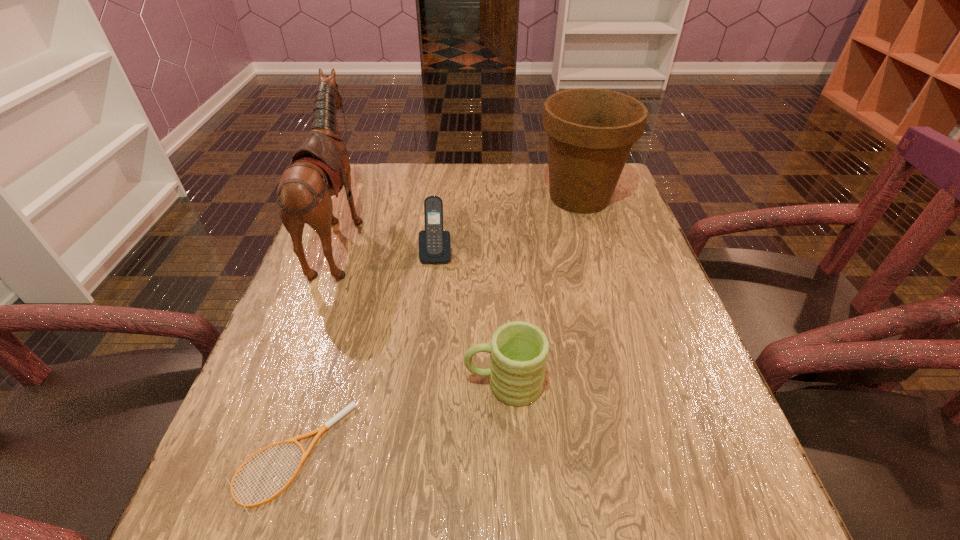
In the image, there is a desktop. Where is `vacant region at the far right corner`? vacant region at the far right corner is located at coordinates (620, 187).

Find the location of a particular element. The image size is (960, 540). vacant point located between the mug and the tallest object is located at coordinates (423, 309).

You are a GUI agent. You are given a task and a screenshot of the screen. Output one action in this format:
    pyautogui.click(x=<x>, y=<y>)
    Task: Click on the empty space that is in between the saddle and the fourth object from left to right
    Image resolution: width=960 pixels, height=540 pixels.
    Given the screenshot: What is the action you would take?
    pyautogui.click(x=423, y=309)

The image size is (960, 540). Find the location of `vacant point located between the shortest object and the tallest object`. vacant point located between the shortest object and the tallest object is located at coordinates (317, 345).

The height and width of the screenshot is (540, 960). I want to click on free space between the saddle and the shortest object, so click(x=317, y=345).

Identify the location of free space that is in between the cellular telephone and the saddle. (389, 245).

This screenshot has width=960, height=540. What are the coordinates of `unoccupied position between the third shortest object and the second tallest object` in the screenshot? It's located at [508, 226].

At what (x,y) coordinates should I click in order to perform the action: click on free space between the saddle and the rightmost object. Please return your answer as a coordinate pair (x, y). The width and height of the screenshot is (960, 540). Looking at the image, I should click on (461, 216).

In order to click on free spot between the rightmost object and the second object from right to left in this screenshot , I will do `click(541, 291)`.

At what (x,y) coordinates should I click in order to perform the action: click on blank region between the shortest object and the rightmost object. Please return your answer as a coordinate pair (x, y). This screenshot has width=960, height=540. Looking at the image, I should click on (436, 326).